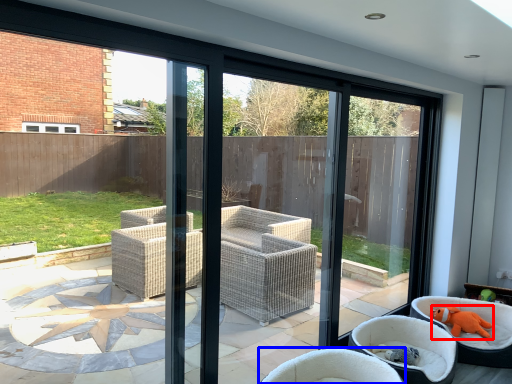
Question: Which object is closer to the camera taking this photo, animal (highlighted by a red box) or chair (highlighted by a blue box)?

Choices:
 (A) animal
 (B) chair

Answer: (B)